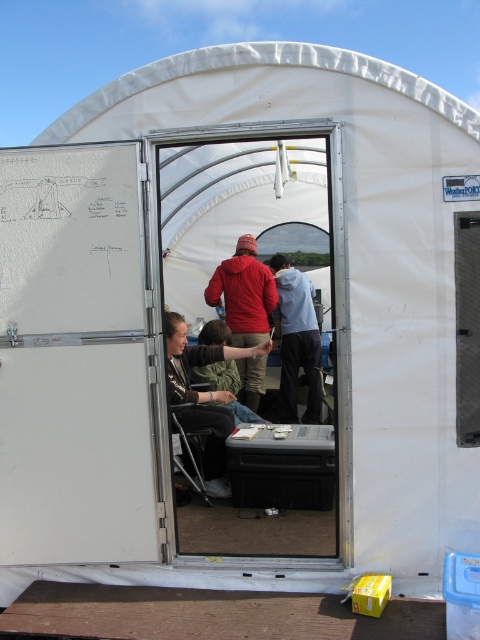
You are standing outside the tent and want to enter. The transparent plastic screen door at center is blocking your path to the matte red jacket at center. Can you step around the door to reach the jacket?

The transparent plastic screen door at center is positioned over matte red jacket at center, meaning the door is in front of the jacket. Since the door is open, you can step through the open door to reach the matte red jacket at center.

You are a delivery person with a box that is 3 feet long. You need to enter through the transparent plastic screen door at center to deliver the box to the matte red jacket at center. Can you fit the box through the door without tilting it?

The distance between the transparent plastic screen door at center and the matte red jacket at center is 3.42 feet. Since the box is 3 feet long, it can fit through the door without tilting as there is enough space.

You are standing at the entrance of the tent and want to move the black plastic trailer at center closer to the matte red jacket at center. How much closer can you bring them together if the minimum safe distance required between them is 0.5 meters?

The current distance between the black plastic trailer at center and the matte red jacket at center is 1.62 meters. To meet the minimum safe distance of 0.5 meters, you can bring them closer by 1.12 meters.